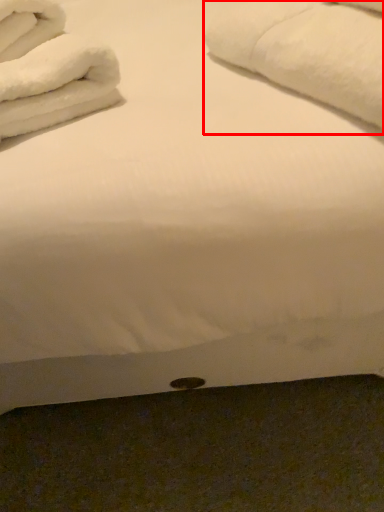
Question: From the image's perspective, where is bath towel (annotated by the red box) located relative to bath towel?

Choices:
 (A) above
 (B) below

Answer: (A)